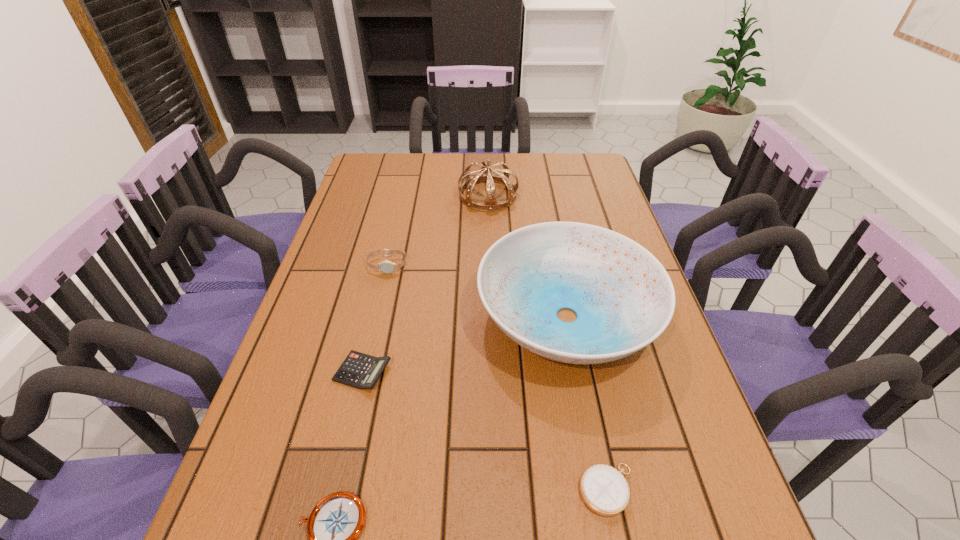
This screenshot has width=960, height=540. Find the location of `tiara`. tiara is located at coordinates (485, 174).

The height and width of the screenshot is (540, 960). I want to click on dish, so click(x=624, y=299).

This screenshot has height=540, width=960. I want to click on watch, so click(x=387, y=267).

I want to click on calculator, so click(x=361, y=371).

At what (x,y) coordinates should I click in order to perform the action: click on the right compass. Please return your answer as a coordinate pair (x, y). The image size is (960, 540). Looking at the image, I should click on (604, 489).

The height and width of the screenshot is (540, 960). Find the location of `vacant area located on the left of the farthest object`. vacant area located on the left of the farthest object is located at coordinates (390, 195).

Find the location of a particular element. The height and width of the screenshot is (540, 960). vacant space positioned on the left of the dish is located at coordinates (364, 316).

Where is `vacant point located 0.180m on the face of the third tallest object`? vacant point located 0.180m on the face of the third tallest object is located at coordinates (374, 322).

Locate an element on the screen. The width and height of the screenshot is (960, 540). vacant space located 0.180m on the right of the calculator is located at coordinates (469, 372).

Image resolution: width=960 pixels, height=540 pixels. In order to click on vacant space located on the back of the right compass in this screenshot , I will do `click(582, 366)`.